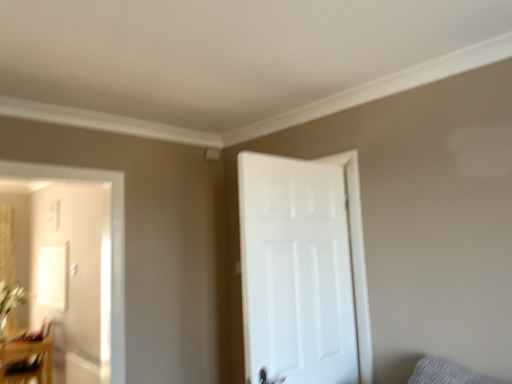
Question: Is wooden table at lower left positioned before white matte door at right?

Choices:
 (A) no
 (B) yes

Answer: (A)

Question: Is wooden table at lower left bigger than white matte door at right?

Choices:
 (A) yes
 (B) no

Answer: (A)

Question: From a real-world perspective, is wooden table at lower left positioned under white matte door at right based on gravity?

Choices:
 (A) yes
 (B) no

Answer: (A)

Question: Could you tell me if wooden table at lower left is turned towards white matte door at right?

Choices:
 (A) yes
 (B) no

Answer: (B)

Question: From the image's perspective, is wooden table at lower left beneath white matte door at right?

Choices:
 (A) yes
 (B) no

Answer: (A)

Question: Considering the relative sizes of wooden table at lower left and white matte door at right in the image provided, is wooden table at lower left thinner than white matte door at right?

Choices:
 (A) yes
 (B) no

Answer: (B)

Question: Considering the relative sizes of gray fabric pillow at lower right and white matte door at right in the image provided, is gray fabric pillow at lower right smaller than white matte door at right?

Choices:
 (A) yes
 (B) no

Answer: (A)

Question: Considering the relative positions of gray fabric pillow at lower right and white matte door at right in the image provided, is gray fabric pillow at lower right to the right of white matte door at right from the viewer's perspective?

Choices:
 (A) yes
 (B) no

Answer: (A)

Question: Does gray fabric pillow at lower right have a greater height compared to white matte door at right?

Choices:
 (A) no
 (B) yes

Answer: (A)

Question: Can you confirm if gray fabric pillow at lower right is thinner than white matte door at right?

Choices:
 (A) yes
 (B) no

Answer: (B)

Question: Can you confirm if gray fabric pillow at lower right is wider than white matte door at right?

Choices:
 (A) yes
 (B) no

Answer: (A)

Question: Does gray fabric pillow at lower right appear on the left side of white matte door at right?

Choices:
 (A) no
 (B) yes

Answer: (A)

Question: Is green leafy plant at left looking in the opposite direction of gray fabric pillow at lower right?

Choices:
 (A) yes
 (B) no

Answer: (B)